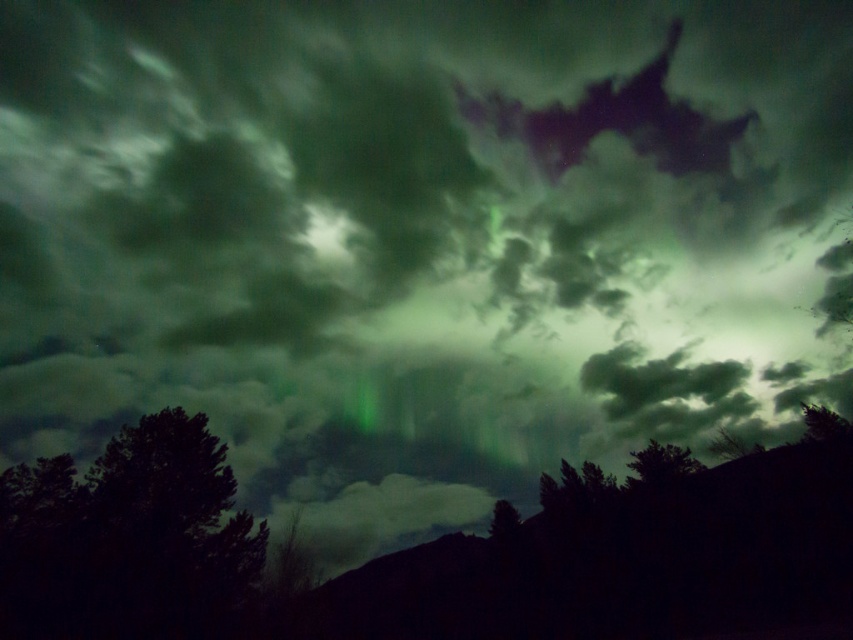
You are an astronomer observing the night sky in the image. You notice a green translucent cloud at center. What are the coordinates of its position in the image?

The green translucent cloud at center is located at coordinates (654, 378).

You are an astronomer observing the night sky. You notice two green elements in the scene. Which one is larger in size between the green translucent cloud at center and the green matte tree at lower right?

The green translucent cloud at center is bigger than the green matte tree at lower right.

You are standing in front of a large window that shows the night sky described. You see two points in the sky, one at point (48, 497) and the other at point (653, 440). Which point is closer to you?

Point (48, 497) is closer to the viewer than point (653, 440).